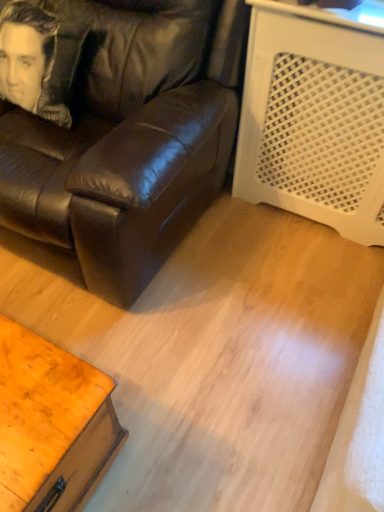
Question: From the image's perspective, is smooth leather pillow at upper left on top of wooden table at lower left?

Choices:
 (A) no
 (B) yes

Answer: (B)

Question: Can you confirm if smooth leather pillow at upper left is wider than wooden table at lower left?

Choices:
 (A) no
 (B) yes

Answer: (B)

Question: From a real-world perspective, is smooth leather pillow at upper left on wooden table at lower left?

Choices:
 (A) no
 (B) yes

Answer: (B)

Question: Is smooth leather pillow at upper left shorter than wooden table at lower left?

Choices:
 (A) no
 (B) yes

Answer: (B)

Question: Is smooth leather pillow at upper left not inside wooden table at lower left?

Choices:
 (A) yes
 (B) no

Answer: (A)

Question: From the image's perspective, is smooth leather pillow at upper left located above or below wooden table at lower left?

Choices:
 (A) above
 (B) below

Answer: (A)

Question: Is point (41, 19) closer or farther from the camera than point (38, 410)?

Choices:
 (A) closer
 (B) farther

Answer: (B)

Question: Is smooth leather pillow at upper left wider or thinner than wooden table at lower left?

Choices:
 (A) wide
 (B) thin

Answer: (A)

Question: Visually, is smooth leather pillow at upper left positioned to the left or to the right of wooden table at lower left?

Choices:
 (A) right
 (B) left

Answer: (B)

Question: From a real-world perspective, is smooth leather pillow at upper left above or below matte black leather couch at center?

Choices:
 (A) above
 (B) below

Answer: (A)

Question: Would you say smooth leather pillow at upper left is to the left or to the right of matte black leather couch at center in the picture?

Choices:
 (A) left
 (B) right

Answer: (A)

Question: From the image's perspective, is smooth leather pillow at upper left located above or below matte black leather couch at center?

Choices:
 (A) below
 (B) above

Answer: (B)

Question: Considering their positions, is smooth leather pillow at upper left located in front of or behind matte black leather couch at center?

Choices:
 (A) front
 (B) behind

Answer: (B)

Question: Relative to smooth leather pillow at upper left, is matte black leather couch at center in front or behind?

Choices:
 (A) behind
 (B) front

Answer: (B)

Question: Choose the correct answer: Is matte black leather couch at center inside smooth leather pillow at upper left or outside it?

Choices:
 (A) outside
 (B) inside

Answer: (A)